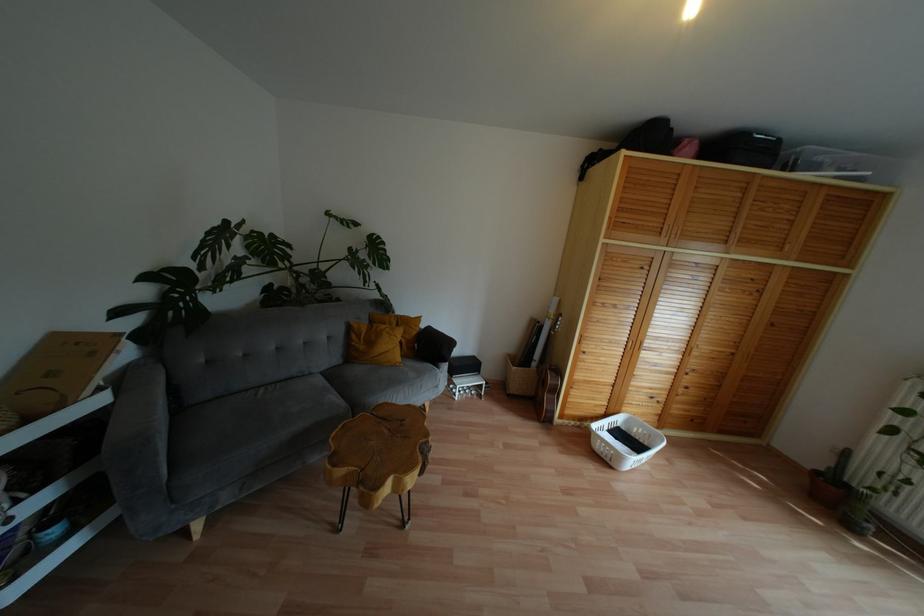
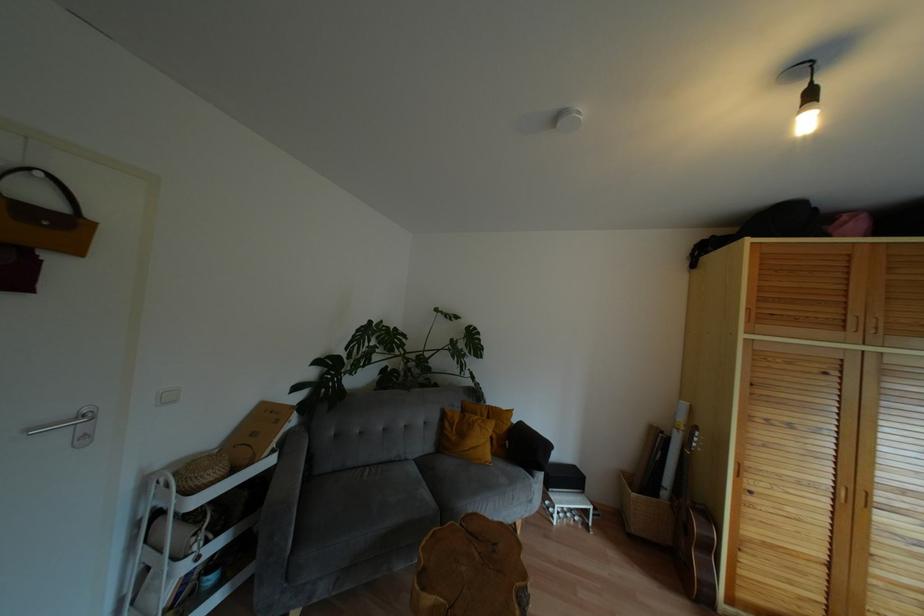
The point at (x=431, y=346) is marked in the first image. Where is the corresponding point in the second image?

(524, 448)